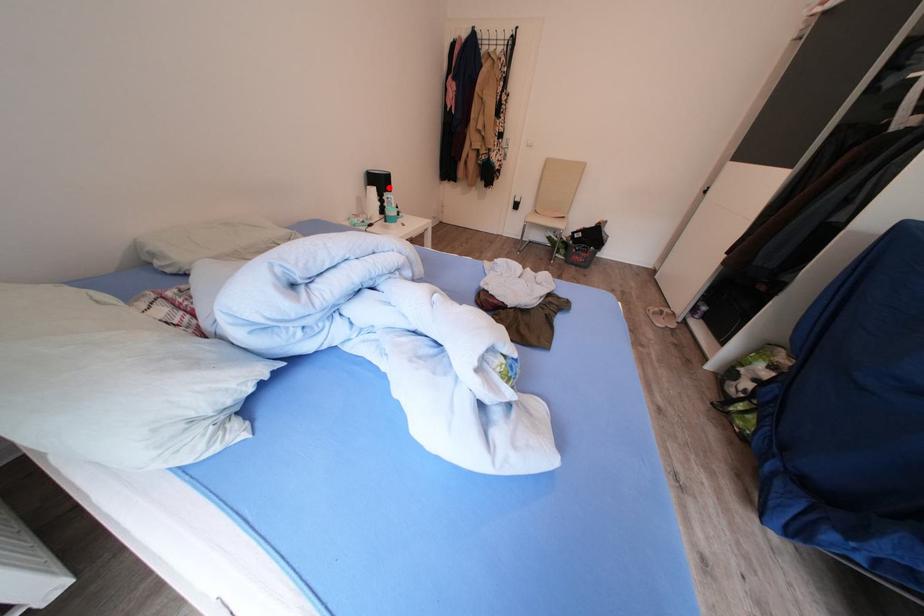
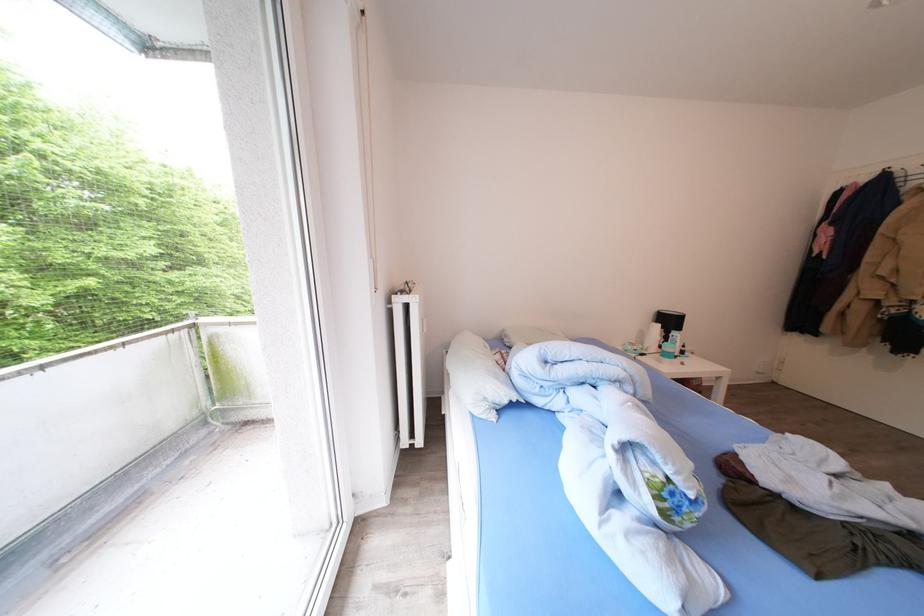
In the second image, find the point that corresponds to the highlighted location in the first image.

(677, 326)